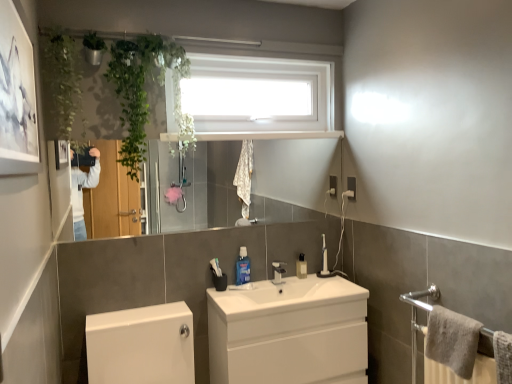
Find the location of a particular element. The image size is (512, 384). free area in between translucent plastic bottle at center, which is the 1th toiletry in right-to-left order, and white plastic tap at center is located at coordinates (290, 276).